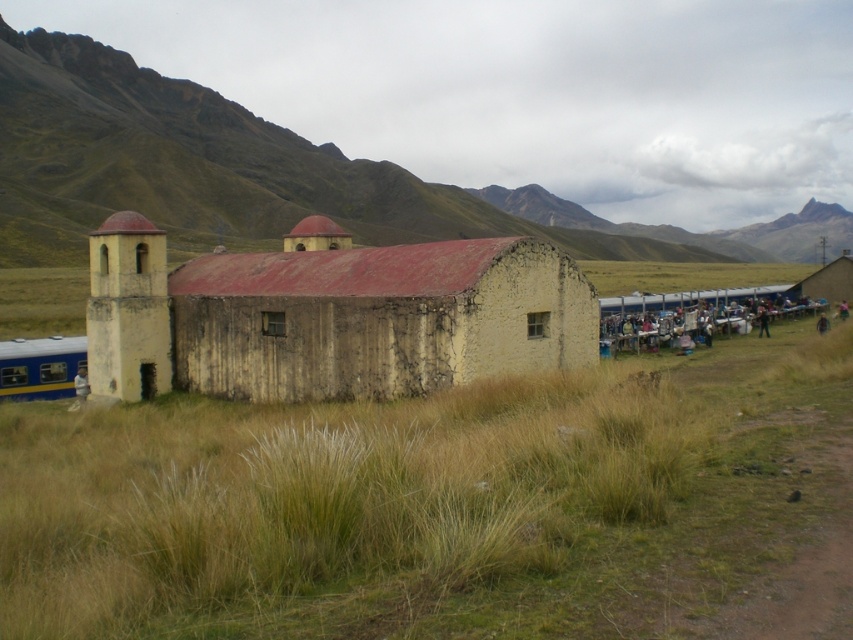
Is yellow concrete building at center taller than white plastic chairs at right?

Indeed, yellow concrete building at center has a greater height compared to white plastic chairs at right.

Can you confirm if yellow concrete building at center is positioned to the left of white plastic chairs at right?

Correct, you'll find yellow concrete building at center to the left of white plastic chairs at right.

Between point (339, 269) and point (740, 321), which one is positioned behind?

The point (740, 321) is behind.

At what (x,y) coordinates should I click in order to perform the action: click on yellow concrete building at center. Please return your answer as a coordinate pair (x, y). Looking at the image, I should click on (328, 316).

Is yellow concrete building at center closer to the viewer compared to blue painted metal train at left?

Yes, it is.

Who is more distant from viewer, [165,376] or [68,346]?

The point [68,346] is behind.

Describe the element at coordinates (328, 316) in the screenshot. This screenshot has height=640, width=853. I see `yellow concrete building at center` at that location.

Locate an element on the screen. Image resolution: width=853 pixels, height=640 pixels. yellow concrete building at center is located at coordinates (328, 316).

Between dry grass at center and blue painted metal train at left, which one appears on the left side from the viewer's perspective?

blue painted metal train at left

Who is more forward, (169, 464) or (4, 362)?

Point (169, 464) is in front.

The image size is (853, 640). In order to click on dry grass at center in this screenshot , I will do `click(424, 502)`.